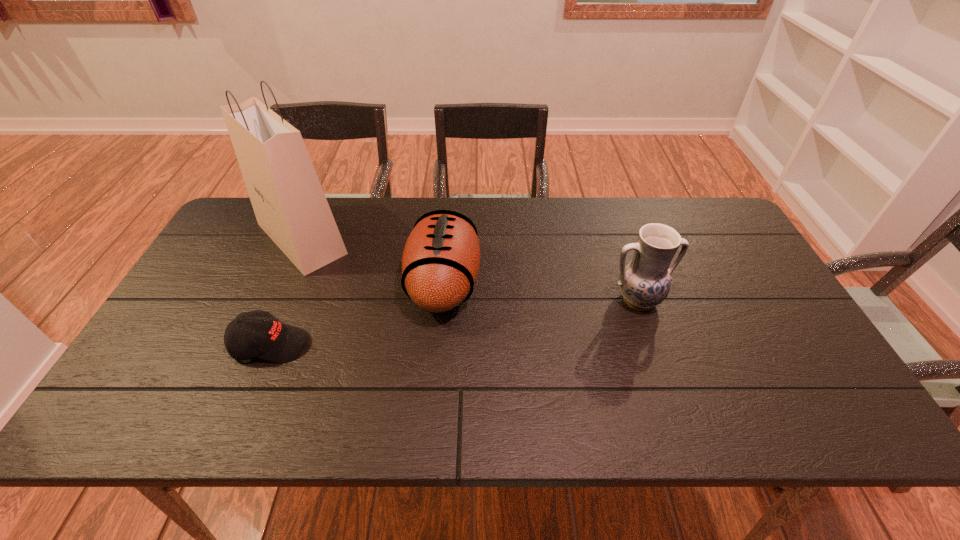
You are a GUI agent. You are given a task and a screenshot of the screen. Output one action in this format:
    pyautogui.click(x=<x>, y=<y>)
    Task: Click on the tallest object
    Image resolution: width=960 pixels, height=540 pixels.
    Given the screenshot: What is the action you would take?
    [290, 206]

Locate an element on the screen. Image resolution: width=960 pixels, height=540 pixels. the rightmost object is located at coordinates (644, 282).

This screenshot has width=960, height=540. In order to click on the second object from right to left in this screenshot , I will do `click(440, 264)`.

Identify the location of football (American). This screenshot has height=540, width=960. (440, 264).

Find the location of `the shortest object`. the shortest object is located at coordinates tap(275, 341).

Identify the location of free space located 0.320m on the right of the shopping bag. This screenshot has width=960, height=540. (455, 238).

Where is `free space located on the right of the pottery`? free space located on the right of the pottery is located at coordinates (743, 300).

Locate an element on the screen. Image resolution: width=960 pixels, height=540 pixels. blank space located 0.110m on the left of the third tallest object is located at coordinates (368, 283).

This screenshot has height=540, width=960. Identify the location of vacant space located on the front-facing side of the baseball cap. pos(389,345).

The width and height of the screenshot is (960, 540). Identify the location of shopping bag positioned at the far edge. (290, 206).